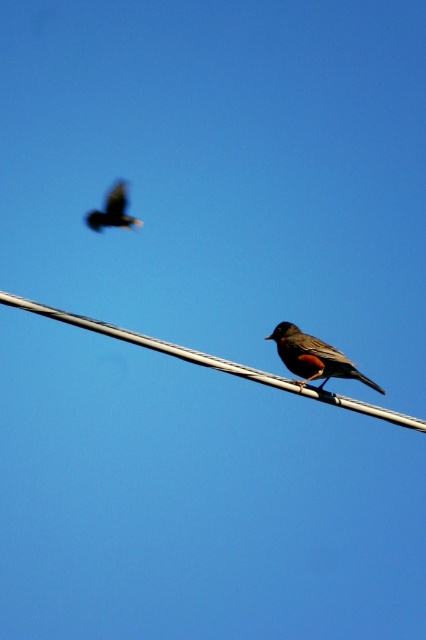
Can you confirm if brown matte bird at center is taller than dark brown feathers at upper left?

No.

Does brown matte bird at center appear on the right side of dark brown feathers at upper left?

Correct, you'll find brown matte bird at center to the right of dark brown feathers at upper left.

Does point (288, 340) come behind point (103, 214)?

No, it is in front of (103, 214).

At what (x,y) coordinates should I click in order to perform the action: click on brown matte bird at center. Please return your answer as a coordinate pair (x, y). Image resolution: width=426 pixels, height=640 pixels. Looking at the image, I should click on (313, 356).

Between metallic wire at center and dark brown feathers at upper left, which one has more height?

dark brown feathers at upper left

Find the location of a particular element. The image size is (426, 640). metallic wire at center is located at coordinates (213, 362).

Does metallic wire at center appear on the left side of brown matte bird at center?

Correct, you'll find metallic wire at center to the left of brown matte bird at center.

Who is positioned more to the left, metallic wire at center or brown matte bird at center?

From the viewer's perspective, metallic wire at center appears more on the left side.

Describe the element at coordinates (213, 362) in the screenshot. Image resolution: width=426 pixels, height=640 pixels. I see `metallic wire at center` at that location.

At what (x,y) coordinates should I click in order to perform the action: click on metallic wire at center. Please return your answer as a coordinate pair (x, y). This screenshot has height=640, width=426. Looking at the image, I should click on click(x=213, y=362).